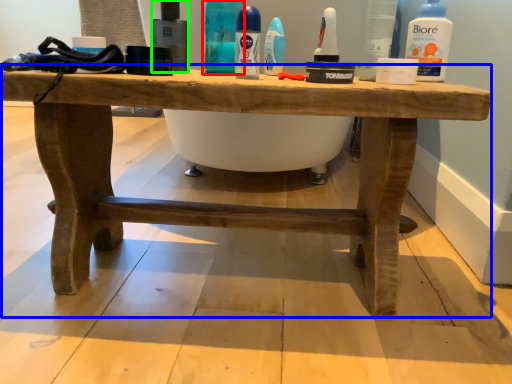
Question: Estimate the real-world distances between objects in this image. Which object is closer to cleaning product (highlighted by a red box), table (highlighted by a blue box) or mouthwash (highlighted by a green box)?

Choices:
 (A) table
 (B) mouthwash

Answer: (B)